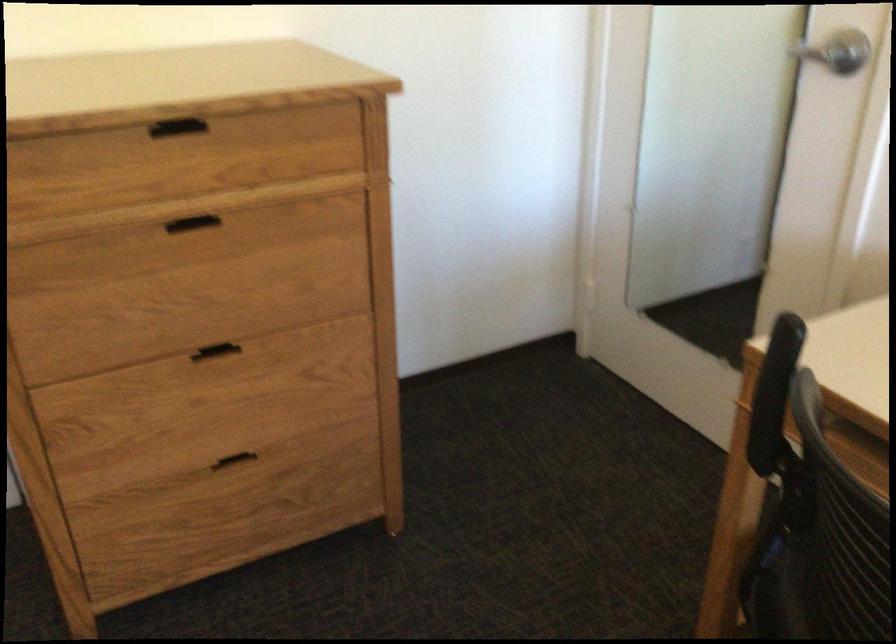
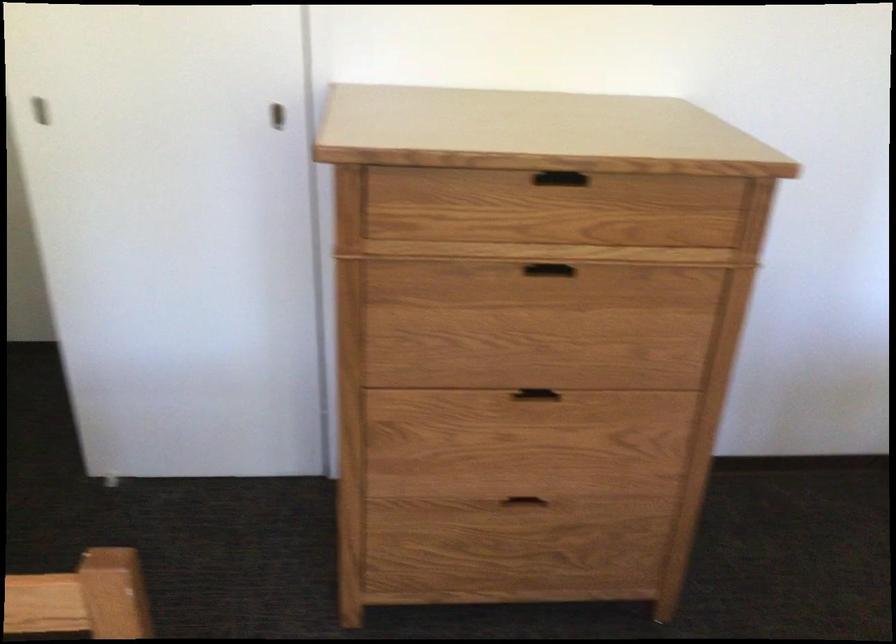
Question: Based on the continuous images, in which direction is the camera rotating? Reply with the corresponding letter.

Choices:
 (A) Left
 (B) Right
 (C) Up
 (D) Down

Answer: (A)